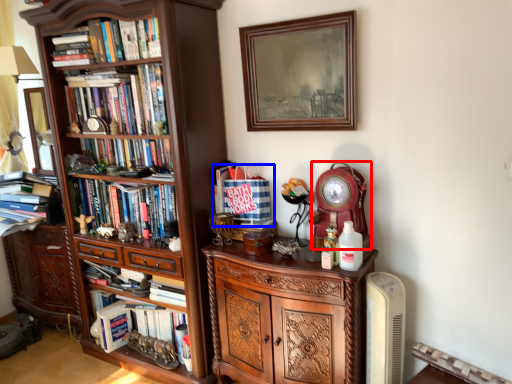
Question: Among these objects, which one is nearest to the camera, clock (highlighted by a red box) or book (highlighted by a blue box)?

Choices:
 (A) clock
 (B) book

Answer: (A)